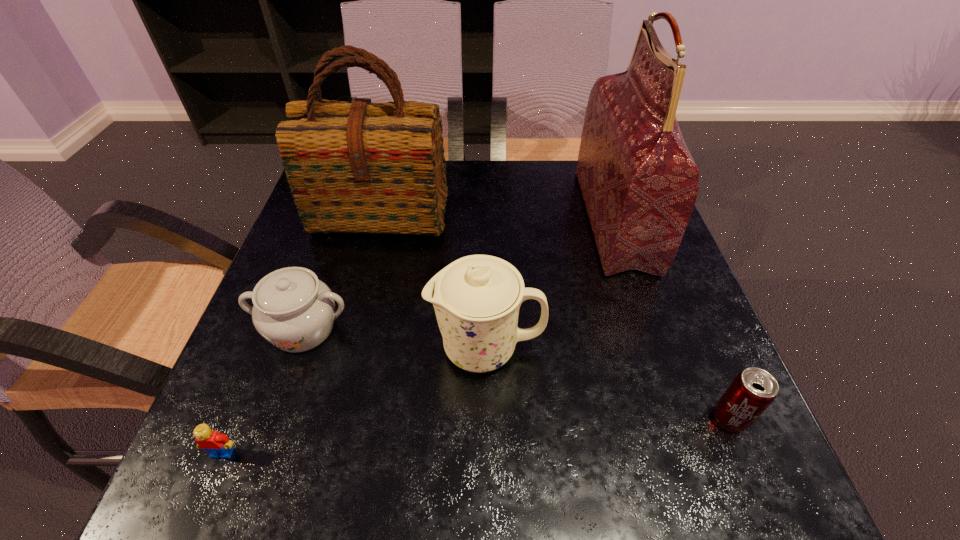
At what (x,y) coordinates should I click in order to perform the action: click on handbag that is at the far edge. Please return your answer as a coordinate pair (x, y). Looking at the image, I should click on (639, 182).

This screenshot has width=960, height=540. What are the coordinates of `shopping bag located in the far edge section of the desktop` in the screenshot? It's located at (353, 167).

I want to click on object at the near edge, so coord(217,444).

In order to click on shopping bag located at the left edge in this screenshot , I will do `click(353, 167)`.

Find the location of a particular element. The height and width of the screenshot is (540, 960). chinaware that is at the left edge is located at coordinates (292, 309).

I want to click on Lego at the left edge, so click(217, 444).

Identify the location of handbag that is at the right edge. The width and height of the screenshot is (960, 540). (639, 182).

What are the coordinates of `beer can that is positioned at the right edge` in the screenshot? It's located at (752, 391).

The image size is (960, 540). I want to click on object that is at the far left corner, so click(353, 167).

Identify the location of object positioned at the near left corner. (217, 444).